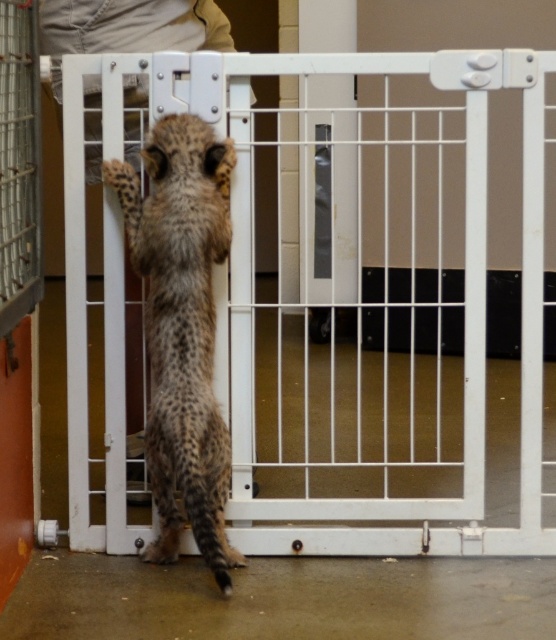
Based on the photo, you are standing in front of the scene described. There is a point marked at coordinates (x=349, y=301). Which object does this point correspond to?

The point at (x=349, y=301) corresponds to the white wire gate at center.

You are a zookeeper trying to ensure the safety of the spotted fur cheetah at center. The white wire gate at center is meant to keep it contained. Based on the scene, is the gate positioned correctly to prevent the cheetah from escaping?

The spotted fur cheetah at center is behind the white wire gate at center, so the gate is positioned correctly to contain the cheetah and prevent escape.

You are a wildlife photographer trying to capture a photo of the spotted fur cheetah at center. Since the white wire gate at center is blocking the background, can you move the gate to get a better shot of the cheetah without any obstructions?

The white wire gate at center is larger in size than spotted fur cheetah at center, so moving the gate might not be feasible as it is bigger than the cheetah. You might need to adjust your position instead.